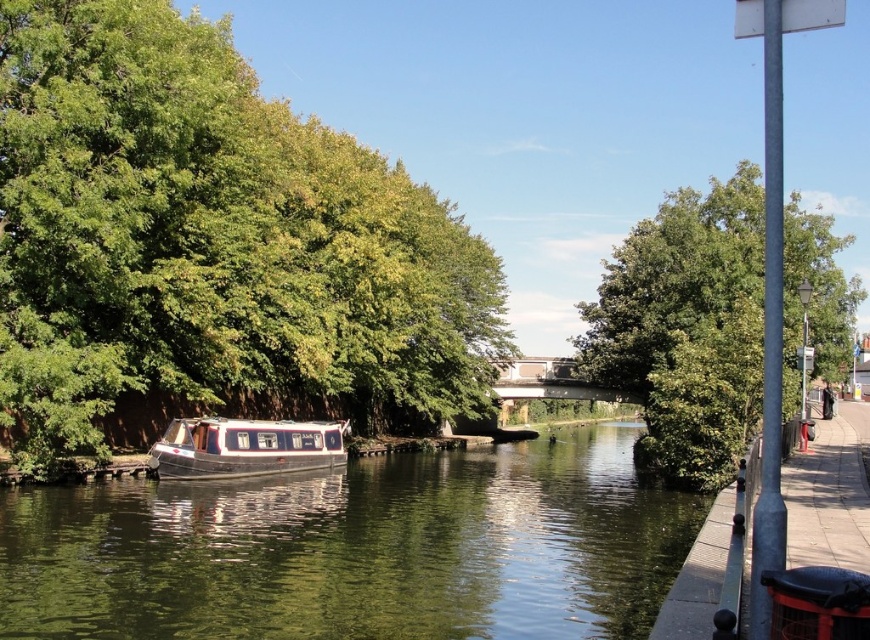
Does point (338, 564) come behind point (239, 438)?

No, (338, 564) is closer to viewer.

Can you confirm if green smooth water at center is shorter than white glossy boat at center?

Incorrect, green smooth water at center's height does not fall short of white glossy boat at center's.

This screenshot has height=640, width=870. Describe the element at coordinates (356, 548) in the screenshot. I see `green smooth water at center` at that location.

You are a GUI agent. You are given a task and a screenshot of the screen. Output one action in this format:
    pyautogui.click(x=<x>, y=<y>)
    Task: Click on the green smooth water at center
    
    Given the screenshot: What is the action you would take?
    pyautogui.click(x=356, y=548)

Does green leafy tree at upper center appear under white glossy boat at center?

Incorrect, green leafy tree at upper center is not positioned below white glossy boat at center.

Does green leafy tree at upper center lie in front of white glossy boat at center?

Yes, it is.

Where is `green leafy tree at upper center`? The image size is (870, 640). green leafy tree at upper center is located at coordinates (686, 326).

Between green leafy tree at left and green smooth water at center, which one appears on the left side from the viewer's perspective?

green leafy tree at left is more to the left.

Is point (289, 170) closer to viewer compared to point (531, 586)?

No, it is not.

You are a GUI agent. You are given a task and a screenshot of the screen. Output one action in this format:
    pyautogui.click(x=<x>, y=<y>)
    Task: Click on the green leafy tree at left
    
    Given the screenshot: What is the action you would take?
    pyautogui.click(x=209, y=236)

Locate an element on the screen. Image resolution: width=870 pixels, height=640 pixels. green leafy tree at left is located at coordinates (209, 236).